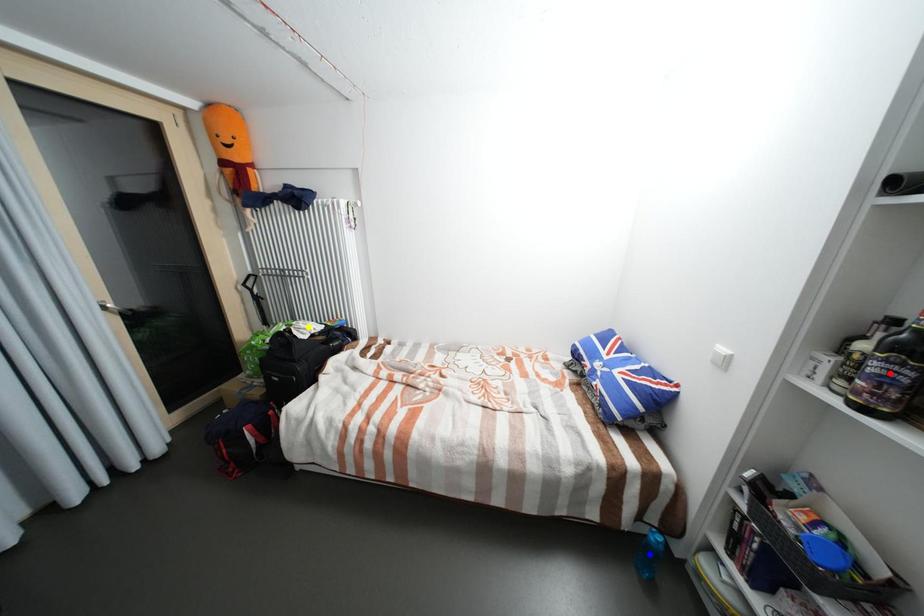
Order these from nearest to farthest:
blue point
red point
yellow point

yellow point → blue point → red point